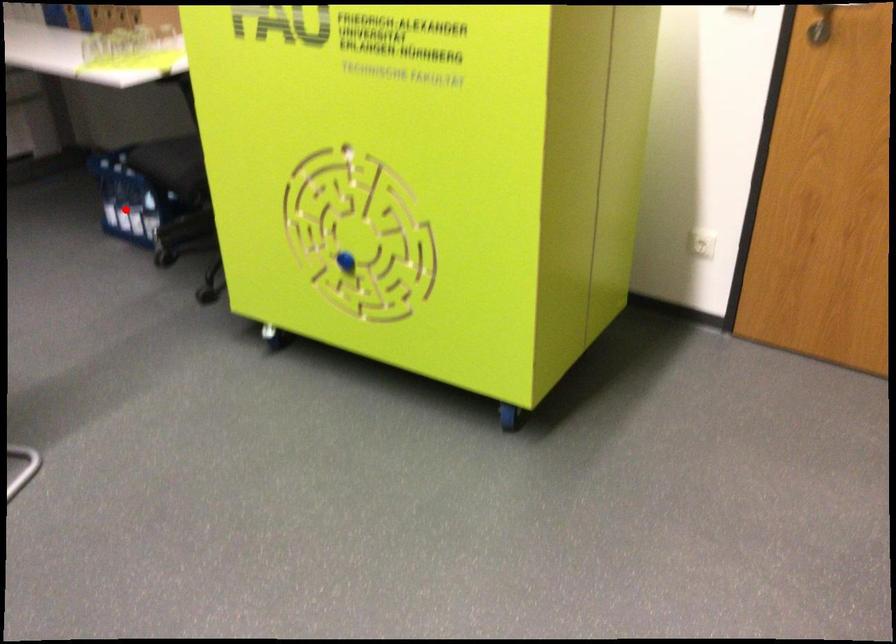
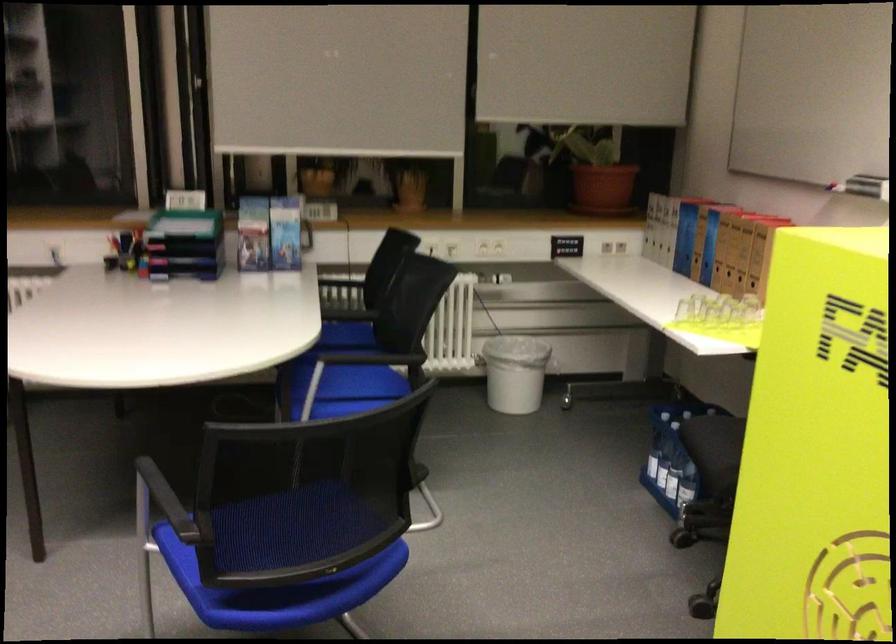
Find the pixel in the second image that matches the highlighted location in the first image.

(661, 465)